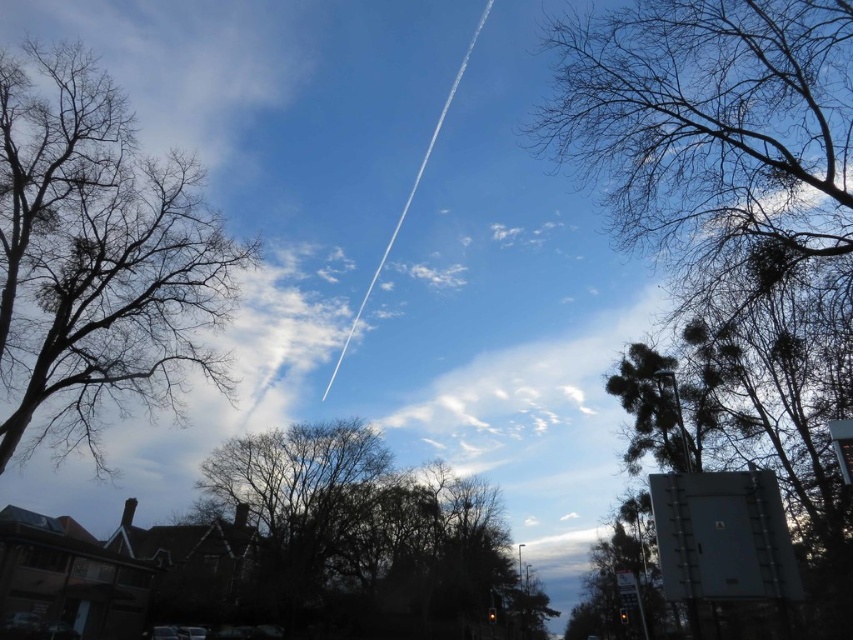
Question: From the image, what is the correct spatial relationship of bare branches at upper left in relation to brown leafless tree at center?

Choices:
 (A) below
 (B) above

Answer: (B)

Question: Which point is farther to the camera?

Choices:
 (A) brown leafless tree at center
 (B) bare branches at upper left

Answer: (A)

Question: Which object is closer to the camera taking this photo?

Choices:
 (A) brown leafless tree at center
 (B) bare branches at upper left

Answer: (B)

Question: Does bare branches at upper left appear over brown leafless tree at center?

Choices:
 (A) yes
 (B) no

Answer: (A)

Question: From the image, what is the correct spatial relationship of bare branches at upper left in relation to brown leafless tree at center?

Choices:
 (A) below
 (B) above

Answer: (B)

Question: Which of the following is the farthest from the observer?

Choices:
 (A) bare branches at upper left
 (B) brown leafless tree at center

Answer: (B)